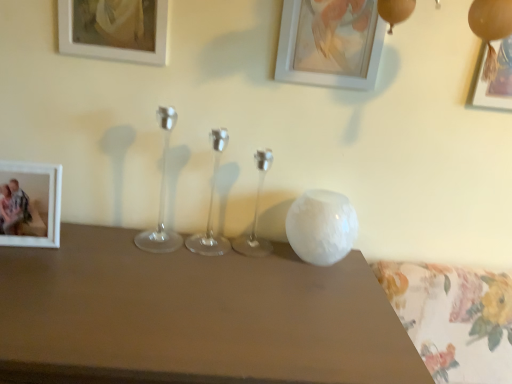
Question: In terms of size, does metallic gold picture frame at upper right, arranged as the fourth picture frame when viewed from the left, appear bigger or smaller than white matte picture frame at left, which is the 1th picture frame from left to right?

Choices:
 (A) big
 (B) small

Answer: (B)

Question: Is metallic gold picture frame at upper right, the 1th picture frame viewed from the right, wider or thinner than white matte picture frame at left, which is the 1th picture frame from left to right?

Choices:
 (A) wide
 (B) thin

Answer: (B)

Question: Which of these objects is positioned closest to the white glossy vase at upper right?

Choices:
 (A) matte white picture frame at upper left, the second picture frame positioned from the left
 (B) metallic gold picture frame at upper right, arranged as the fourth picture frame when viewed from the left
 (C) white matte picture frame at upper center, which is counted as the 2th picture frame, starting from the right
 (D) white matte picture frame at left, which is the 4th picture frame in right-to-left order

Answer: (D)

Question: Considering the real-world distances, which object is closest to the matte white picture frame at upper left, the second picture frame positioned from the left?

Choices:
 (A) white matte picture frame at upper center, which is counted as the 3th picture frame, starting from the left
 (B) metallic gold picture frame at upper right, arranged as the fourth picture frame when viewed from the left
 (C) white glossy vase at upper right
 (D) white matte picture frame at left, which is the 4th picture frame in right-to-left order

Answer: (D)